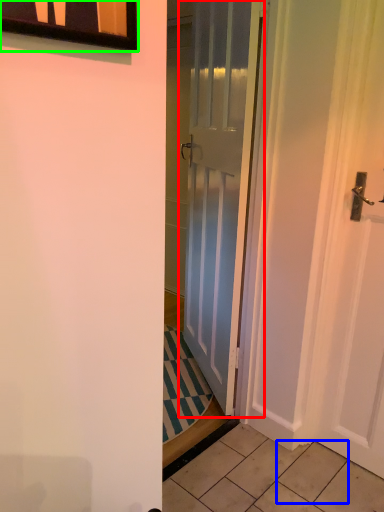
Question: Based on their relative distances, which object is nearer to door (highlighted by a red box)? Choose from tile (highlighted by a blue box) and window (highlighted by a green box).

Choices:
 (A) tile
 (B) window

Answer: (A)